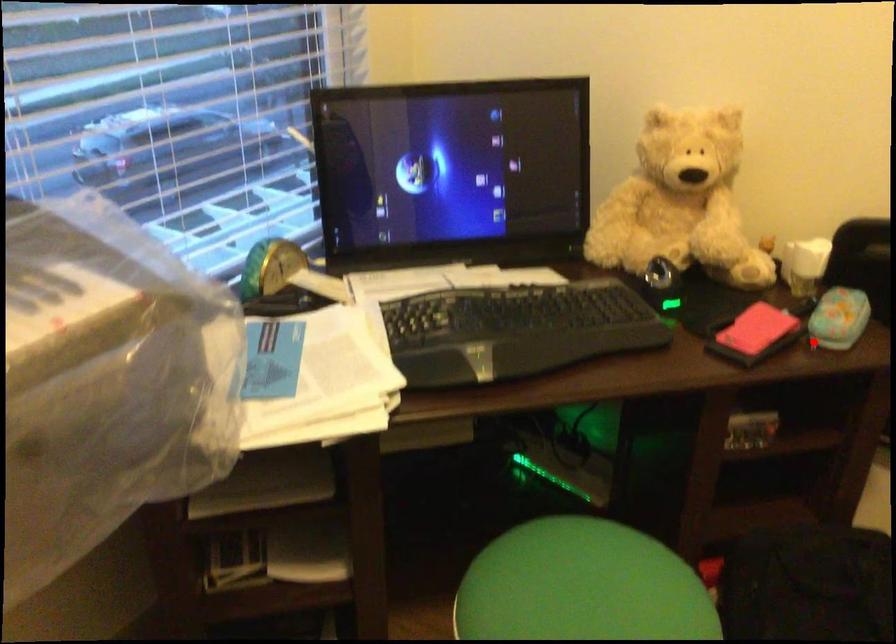
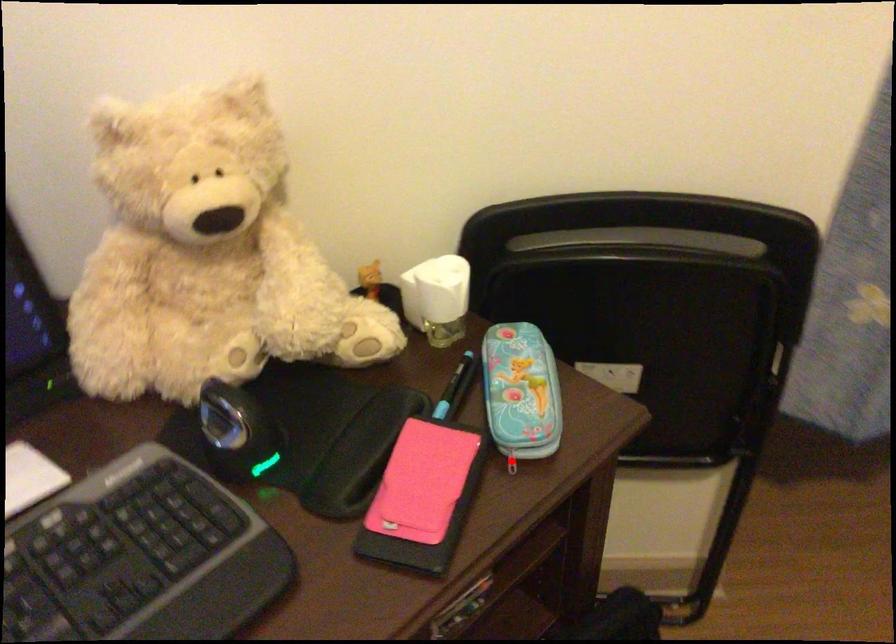
I am providing you with two images of the same scene from different viewpoints. A red point is marked on the first image and another point is marked on the second image. Does the point marked in image1 correspond to the same location as the one in image2?

Yes